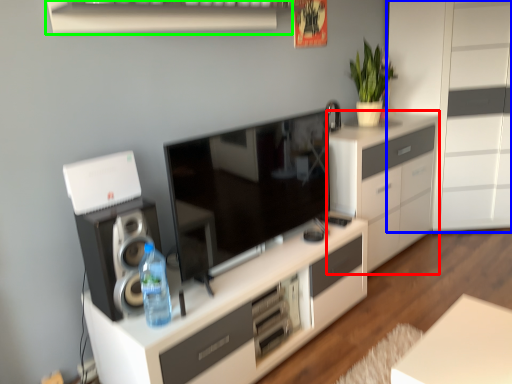
Question: Which object is the closest to the cabinetry (highlighted by a red box)? Choose among these: chest of drawers (highlighted by a blue box) or shelf (highlighted by a green box).

Choices:
 (A) chest of drawers
 (B) shelf

Answer: (A)